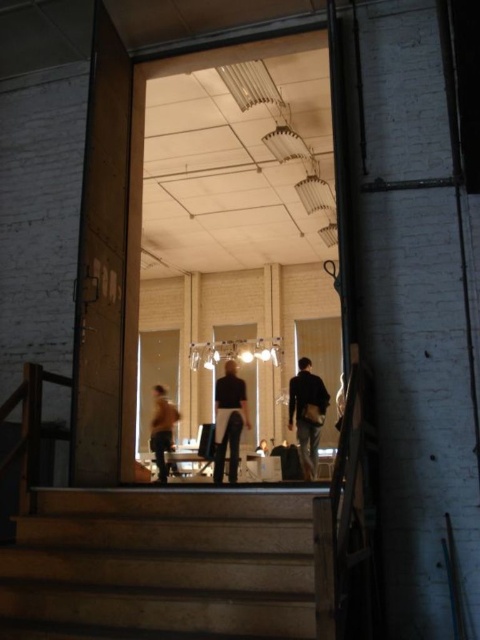
Looking at this image, you are standing outside the glass door and see two people inside. One is wearing dark gray pants at center and the other has an orange fabric jacket at lower left. Which person is closer to the right side of the door?

The dark gray pants at center are to the right of the orange fabric jacket at lower left, so the person wearing dark gray pants at center is closer to the right side of the door.

You are standing at the entrance of the office and want to hang your dark fabric jacket at center on the wall near the brown wooden stairs at lower left. Can you walk directly to the stairs without moving the jacket first?

The brown wooden stairs at lower left is in front of dark fabric jacket at center, meaning the jacket is blocking the path to the stairs. You need to move the jacket first before walking to the stairs.

Based on the photo, you are an office worker who needs to reach the orange fabric jacket at lower left without stepping on the dark fabric jacket at center. How can you navigate around it?

The dark fabric jacket at center is located above the orange fabric jacket at lower left, so you can safely step over or around the dark fabric jacket at center to reach the orange fabric jacket at lower left without stepping on it.